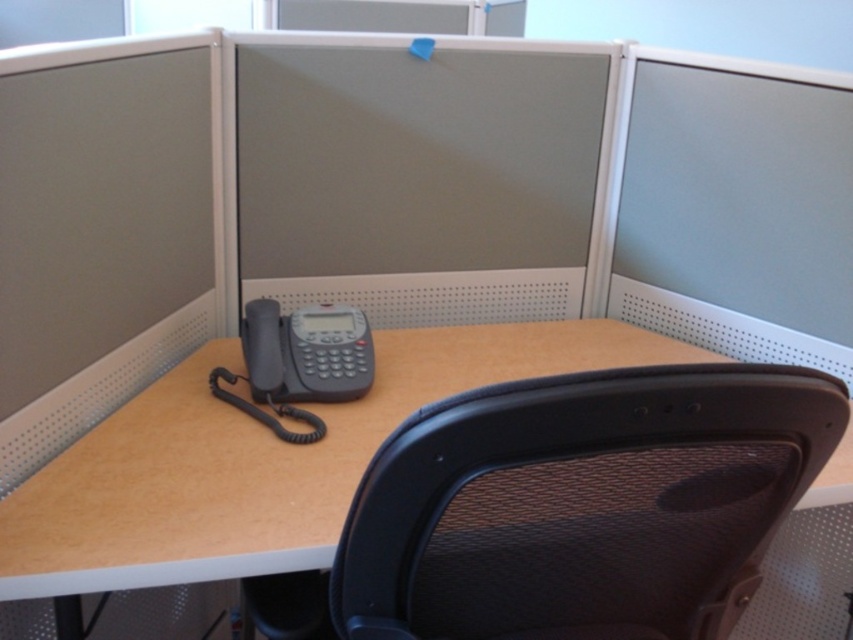
Who is shorter, matte gray monitor at center or matte gray monitor at upper right?

matte gray monitor at center is shorter.

Does matte gray monitor at center have a lesser height compared to matte gray monitor at upper right?

Yes.

Is point (564, 209) positioned behind point (651, 108)?

Yes, it is.

The image size is (853, 640). Identify the location of matte gray monitor at center. (421, 177).

Who is taller, matte gray monitor at center or matte black telephone at center?

matte gray monitor at center

Which is in front, point (552, 212) or point (140, 394)?

Point (140, 394) is in front.

Find the location of a particular element. matte gray monitor at center is located at coordinates (421, 177).

Is matte black telephone at center positioned in front of matte gray monitor at upper right?

Yes, it is in front of matte gray monitor at upper right.

Is matte black telephone at center shorter than matte gray monitor at upper right?

Yes.

Does point (107, 508) come behind point (766, 204)?

That is False.

Where is `matte black telephone at center`? The image size is (853, 640). matte black telephone at center is located at coordinates (260, 460).